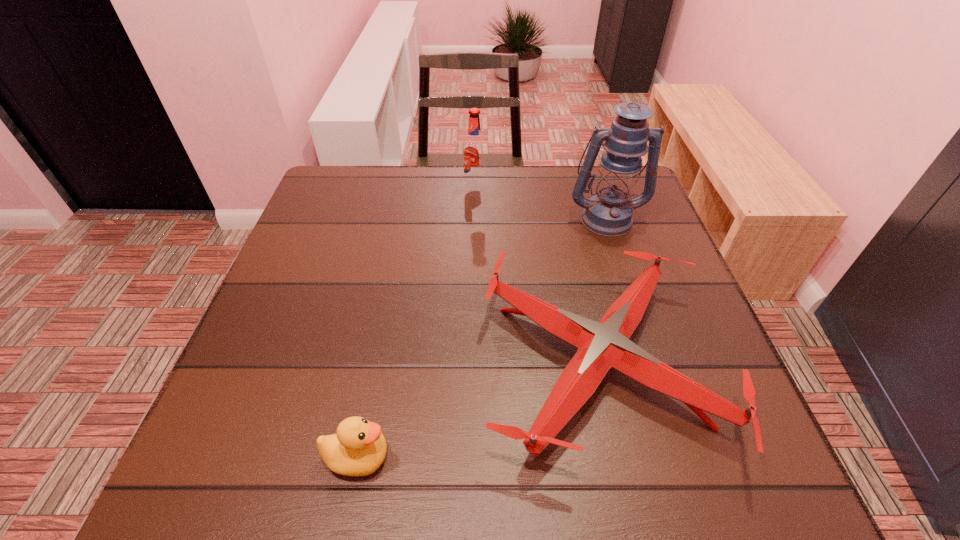
This screenshot has height=540, width=960. I want to click on lantern situated at the far edge, so click(x=609, y=213).

Where is `root beer that is at the far edge`? The image size is (960, 540). root beer that is at the far edge is located at coordinates (474, 152).

Where is `duck positioned at the near edge`? duck positioned at the near edge is located at coordinates (358, 448).

The image size is (960, 540). What are the coordinates of `drone located at the near edge` in the screenshot? It's located at (602, 345).

Find the location of a particular element. This screenshot has height=540, width=960. lantern at the right edge is located at coordinates (609, 213).

Find the location of a particular element. This screenshot has height=540, width=960. drone at the right edge is located at coordinates (602, 345).

Locate an element on the screen. The width and height of the screenshot is (960, 540). object at the far right corner is located at coordinates (609, 213).

This screenshot has width=960, height=540. What are the coordinates of `object that is at the near right corner` in the screenshot? It's located at (602, 345).

The height and width of the screenshot is (540, 960). I want to click on vacant area at the far edge, so click(481, 199).

Locate an element on the screen. The image size is (960, 540). free region at the near edge of the desktop is located at coordinates (492, 452).